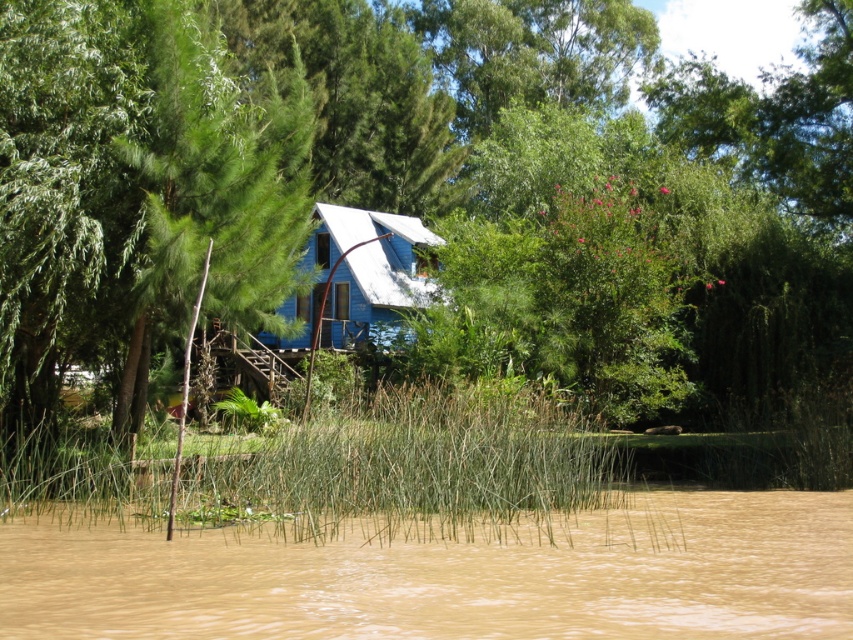
Is the position of green leafy tree at center less distant than that of brown muddy water at lower center?

No, it is not.

Is point (286, 19) less distant than point (347, 573)?

No, (286, 19) is further to viewer.

Who is more forward, (152, 320) or (165, 547)?

Point (165, 547) is more forward.

Where is `green leafy tree at center`? Image resolution: width=853 pixels, height=640 pixels. green leafy tree at center is located at coordinates (421, 195).

Who is more forward, (816, 580) or (312, 532)?

Positioned in front is point (816, 580).

Is brown muddy water at lower center bigger than green grassy reed at center?

Actually, brown muddy water at lower center might be smaller than green grassy reed at center.

Measure the distance between brown muddy water at lower center and camera.

A distance of 7.61 meters exists between brown muddy water at lower center and camera.

Locate an element on the screen. This screenshot has width=853, height=640. brown muddy water at lower center is located at coordinates point(453,576).

Is green leafy tree at center to the right of green grassy reed at center from the viewer's perspective?

Correct, you'll find green leafy tree at center to the right of green grassy reed at center.

Is green leafy tree at center to the left of green grassy reed at center from the viewer's perspective?

Incorrect, green leafy tree at center is not on the left side of green grassy reed at center.

Locate an element on the screen. The width and height of the screenshot is (853, 640). green leafy tree at center is located at coordinates (421, 195).

You are a GUI agent. You are given a task and a screenshot of the screen. Output one action in this format:
    pyautogui.click(x=<x>, y=<y>)
    Task: Click on the green leafy tree at center
    The width and height of the screenshot is (853, 640).
    Given the screenshot: What is the action you would take?
    tap(421, 195)